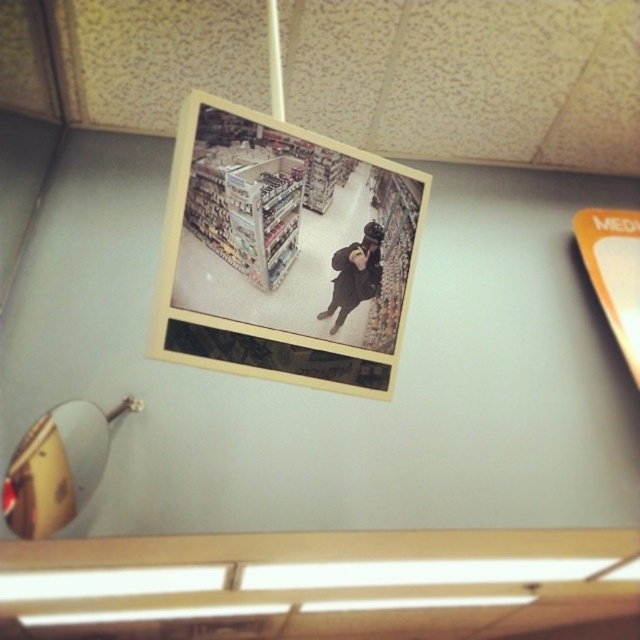
Who is lower down, yellow matte photo frame at center or gold metallic lamp at lower left?

gold metallic lamp at lower left is lower down.

Is yellow matte photo frame at center positioned before gold metallic lamp at lower left?

Yes, yellow matte photo frame at center is in front of gold metallic lamp at lower left.

Is point (342, 356) positioned behind point (42, 512)?

No.

You are a GUI agent. You are given a task and a screenshot of the screen. Output one action in this format:
    pyautogui.click(x=<x>, y=<y>)
    Task: Click on the yellow matte photo frame at center
    This screenshot has height=640, width=640.
    Given the screenshot: What is the action you would take?
    pyautogui.click(x=284, y=250)

Can you confirm if gold metallic lamp at lower left is positioned below matte black jacket at center?

Yes.

Does point (45, 502) lie behind point (378, 276)?

Yes, it is behind point (378, 276).

Between point (72, 404) and point (342, 298), which one is positioned in front?

Point (342, 298) is more forward.

Identify the location of gold metallic lamp at lower left. This screenshot has width=640, height=640. (58, 467).

Is point (301, 316) behind point (337, 268)?

That is False.

Does yellow matte photo frame at center appear under matte black jacket at center?

Actually, yellow matte photo frame at center is above matte black jacket at center.

At what (x,y) coordinates should I click in order to perform the action: click on yellow matte photo frame at center. Please return your answer as a coordinate pair (x, y). The width and height of the screenshot is (640, 640). Looking at the image, I should click on (284, 250).